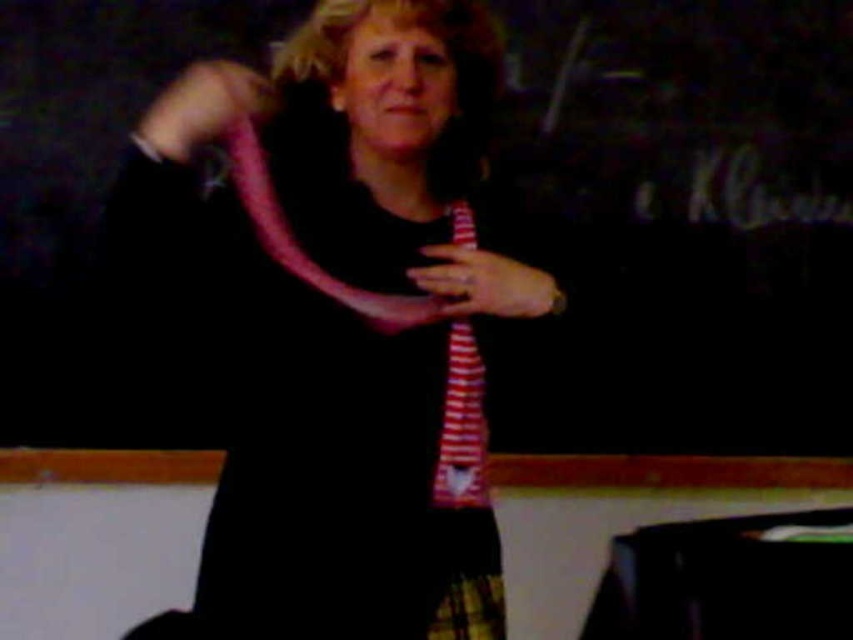
Is black matte dress at center below striped fabric tie at center?

Actually, black matte dress at center is above striped fabric tie at center.

Measure the distance between black matte dress at center and camera.

black matte dress at center and camera are 3.80 feet apart.

The height and width of the screenshot is (640, 853). In order to click on black matte dress at center in this screenshot , I will do `click(339, 467)`.

What do you see at coordinates (462, 426) in the screenshot? I see `striped fabric tie at center` at bounding box center [462, 426].

From the picture: Does striped fabric tie at center have a greater width compared to pink striped fabric at center?

In fact, striped fabric tie at center might be narrower than pink striped fabric at center.

Does point (483, 422) come in front of point (486, 252)?

No.

This screenshot has width=853, height=640. Identify the location of striped fabric tie at center. (462, 426).

Does pink striped scarf at upper center appear under pink striped fabric at center?

No.

Which is in front, point (190, 88) or point (436, 280)?

Point (190, 88) is in front.

In order to click on pink striped scarf at upper center in this screenshot , I will do `click(201, 108)`.